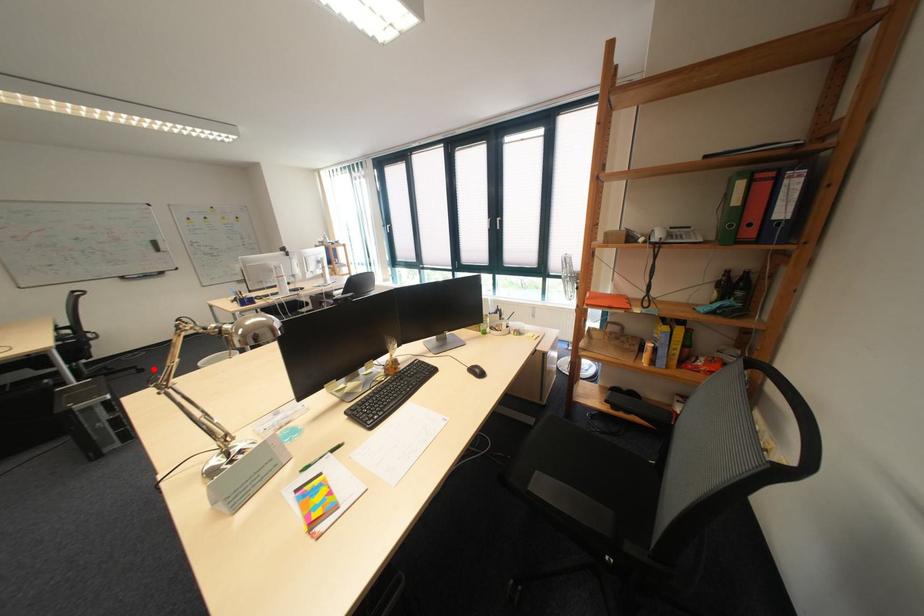
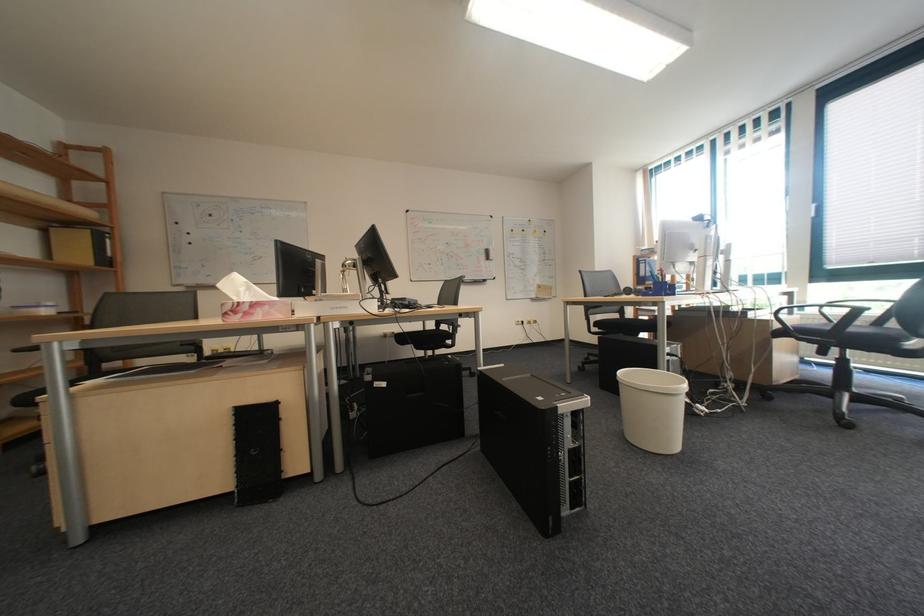
Question: I am providing you with two images of the same scene from different viewpoints. A red point is shown in image1. For the corresponding object point in image2, is it positioned nearer or farther from the camera?

Choices:
 (A) Nearer
 (B) Farther

Answer: (B)